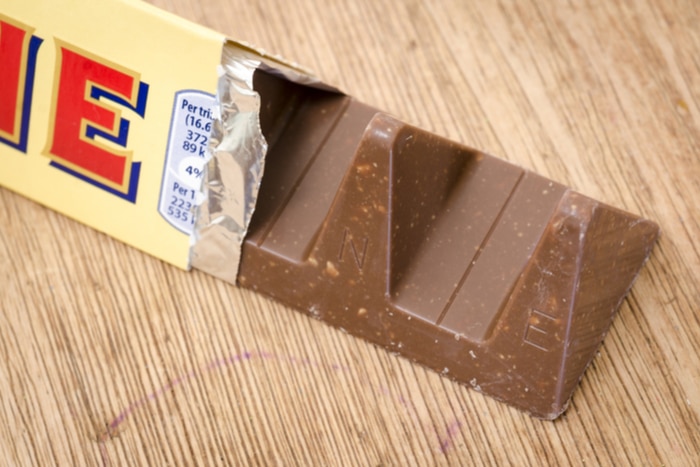
The image size is (700, 467). What are the coordinates of `pen mark on table` in the screenshot? It's located at (x=129, y=408).